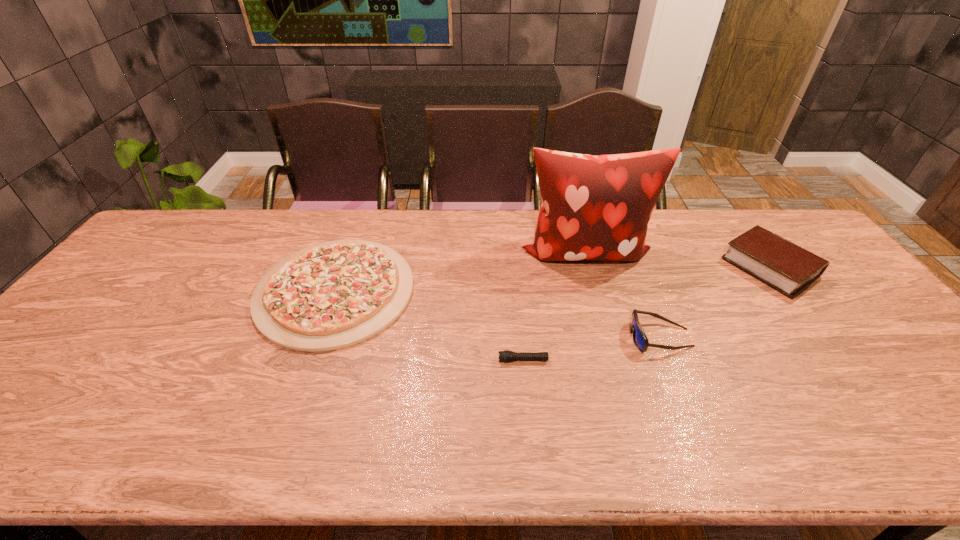
At what (x,y) coordinates should I click in order to perform the action: click on vacant point at the far edge. Please return your answer as a coordinate pair (x, y). Image resolution: width=960 pixels, height=540 pixels. Looking at the image, I should click on (667, 231).

This screenshot has width=960, height=540. In the image, there is a desktop. Identify the location of blank space at the near edge. (670, 437).

The image size is (960, 540). In the image, there is a desktop. Identify the location of vacant space at the left edge. (153, 257).

What are the coordinates of `free region at the right edge` in the screenshot? It's located at coord(911,375).

The image size is (960, 540). In order to click on blank region between the fourth tallest object and the sunglasses in this screenshot , I will do `click(497, 314)`.

Find the location of a particular element. This screenshot has width=960, height=540. empty space between the fourth tallest object and the sunglasses is located at coordinates (497, 314).

Locate an element on the screen. The width and height of the screenshot is (960, 540). free space between the rightmost object and the fourth tallest object is located at coordinates (553, 279).

Locate an element on the screen. This screenshot has height=540, width=960. vacant space that is in between the Bible and the tallest object is located at coordinates (678, 260).

Locate an element on the screen. unoccupied area between the sunglasses and the cushion is located at coordinates (622, 295).

Find the location of a particular element. This screenshot has height=540, width=960. free spot between the sunglasses and the tallest object is located at coordinates (622, 295).